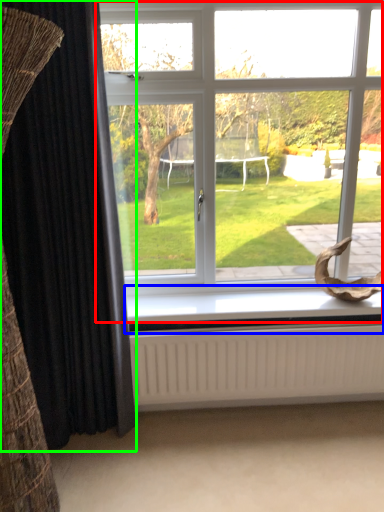
Question: Estimate the real-world distances between objects in this image. Which object is farther from window (highlighted by a red box), window sill (highlighted by a blue box) or curtain (highlighted by a green box)?

Choices:
 (A) window sill
 (B) curtain

Answer: (B)